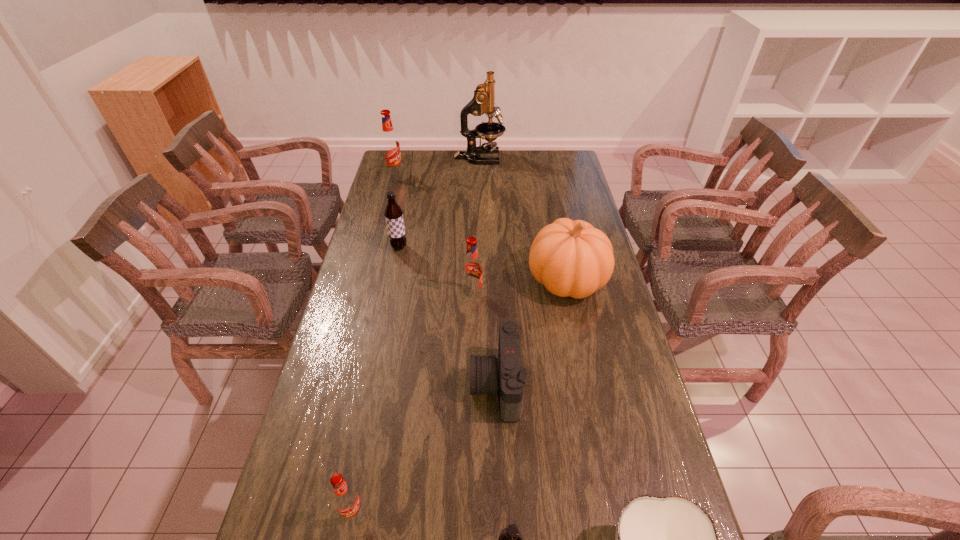
Find the location of `gray microscope`. gray microscope is located at coordinates (483, 102).

Identify the location of microscope. Image resolution: width=960 pixels, height=540 pixels. (483, 102).

Locate an element on the screen. The image size is (960, 540). the tallest root beer is located at coordinates (390, 146).

This screenshot has width=960, height=540. Identify the location of the farthest red root beer. (390, 146).

Find the location of a particular element. orange pumpkin is located at coordinates (571, 258).

Where is `the second farthest red root beer`? The image size is (960, 540). the second farthest red root beer is located at coordinates (472, 268).

Identify the location of the second root beer from right to left. The height and width of the screenshot is (540, 960). (472, 268).

At what (x,y) coordinates should I click in order to perform the action: click on the left brown root beer. Please return your answer as a coordinate pair (x, y). Looking at the image, I should click on (393, 213).

This screenshot has height=540, width=960. In order to click on the seventh nearest object in this screenshot , I will do `click(393, 213)`.

Identify the location of the nearest red root beer. (346, 499).